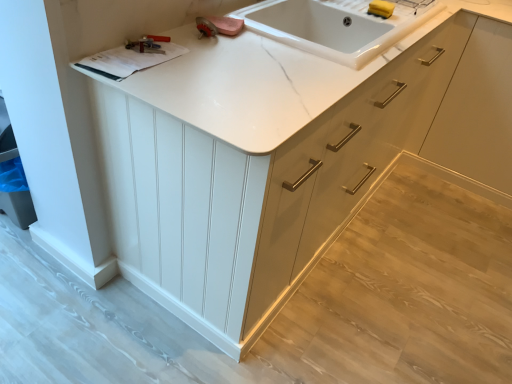
The height and width of the screenshot is (384, 512). I want to click on vacant region in front of metallic silver tool at upper center, so 138,68.